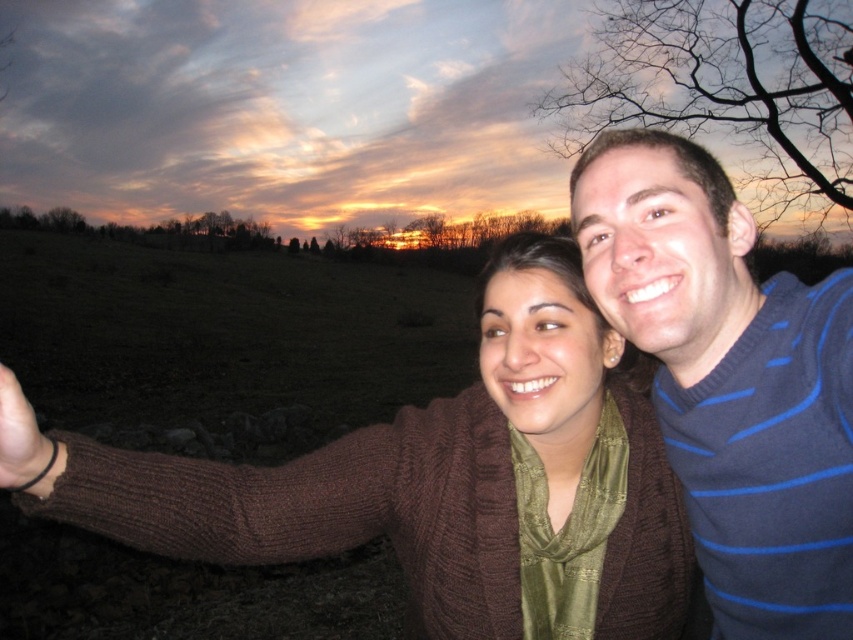
You are a photographer trying to capture a group photo of two friends. You notice the blue striped sweater at right and the smooth skin hand at lower left in your frame. Which object should you adjust to ensure both are visible in the photo?

The blue striped sweater at right is much taller than the smooth skin hand at lower left. To ensure both are visible, you should adjust the angle or zoom so that the taller blue striped sweater at right and the shorter smooth skin hand at lower left are both within the frame.

You are a photographer trying to capture a group photo of two friends. One is wearing a blue striped sweater at right and the other is holding a camera. The minimum focusing distance for your camera is 36 inches. Can you take a clear photo of both subjects without moving them?

The blue striped sweater at right and camera are 37.02 inches apart from each other. Since the minimum focusing distance is 36 inches, the camera can focus on both subjects as the distance between them is within the required range.